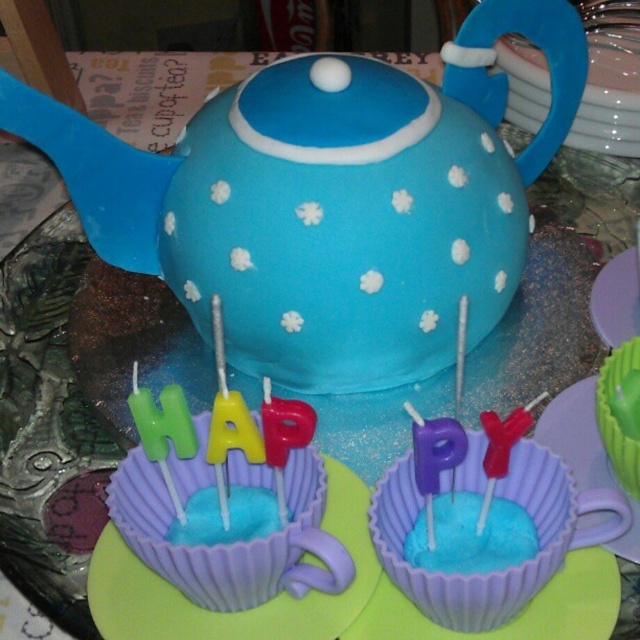
Can you confirm if matte purple cupcake liner at center is wider than matte purple saucer at center?

Yes, matte purple cupcake liner at center is wider than matte purple saucer at center.

Which is in front, point (326, 602) or point (360, 625)?

Point (360, 625) is in front.

This screenshot has height=640, width=640. Describe the element at coordinates (237, 611) in the screenshot. I see `matte purple cupcake liner at center` at that location.

Where is `matte purple cupcake liner at center`? matte purple cupcake liner at center is located at coordinates (237, 611).

Does point (556, 541) lie behind point (296, 604)?

No, it is not.

Between point (410, 588) and point (182, 620), which one is positioned in front?

Point (410, 588) is in front.

The height and width of the screenshot is (640, 640). I want to click on blue fondant cupcake at center, so click(x=496, y=570).

Who is more forward, (388, 616) or (612, 468)?

Positioned in front is point (388, 616).

Is point (604, 554) closer to viewer compared to point (602, 381)?

Yes.

Does point (396, 625) lie in front of point (612, 465)?

Yes.

Find the location of a particular element. matte purple saucer at center is located at coordinates (515, 616).